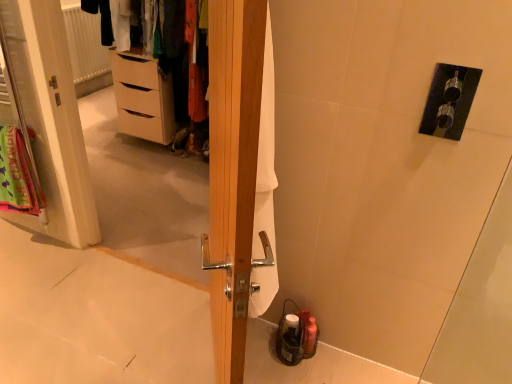
Question: In the image, is wooden door at center positioned in front of or behind neon green fabric at left?

Choices:
 (A) front
 (B) behind

Answer: (A)

Question: Considering the positions of wooden door at center and neon green fabric at left in the image, is wooden door at center taller or shorter than neon green fabric at left?

Choices:
 (A) tall
 (B) short

Answer: (A)

Question: Which is farther from the light brown wooden chest of drawers at left?

Choices:
 (A) white fabric screen door at left
 (B) wooden door at center
 (C) matte white dresser at upper left
 (D) white textured radiator at upper left
 (E) neon green fabric at left

Answer: (B)

Question: Which of these objects is positioned closest to the light brown wooden chest of drawers at left?

Choices:
 (A) neon green fabric at left
 (B) white textured radiator at upper left
 (C) white fabric screen door at left
 (D) matte white dresser at upper left
 (E) wooden door at center

Answer: (D)